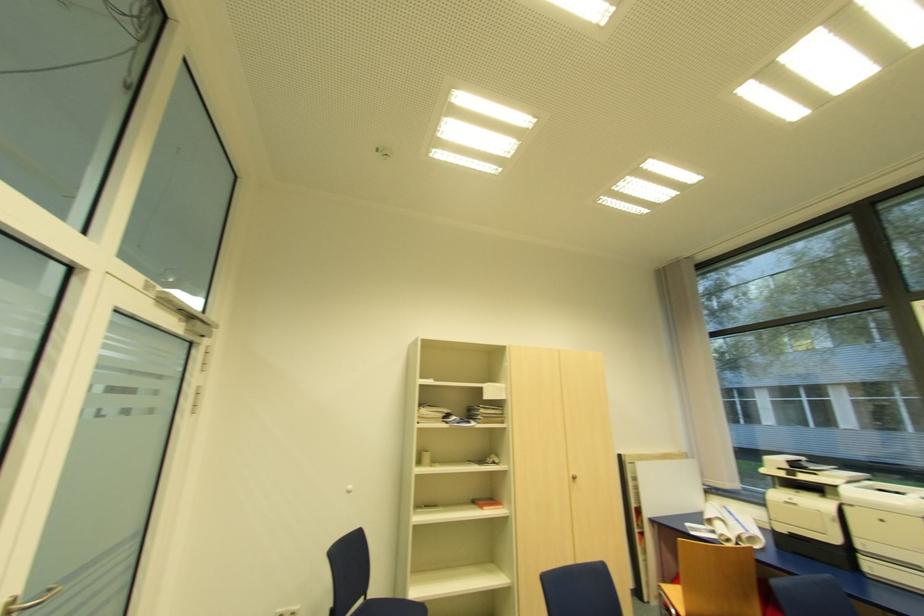
What do you see at coordinates (29, 601) in the screenshot? This screenshot has width=924, height=616. I see `the silver door handle` at bounding box center [29, 601].